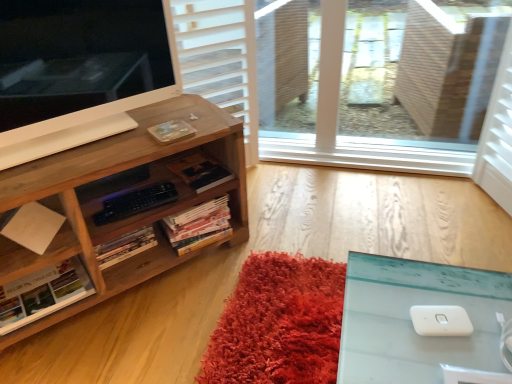
What are the coordinates of `free space above white paper at left, the first book positioned from the left (from a real-world perspective)` in the screenshot? It's located at (32, 284).